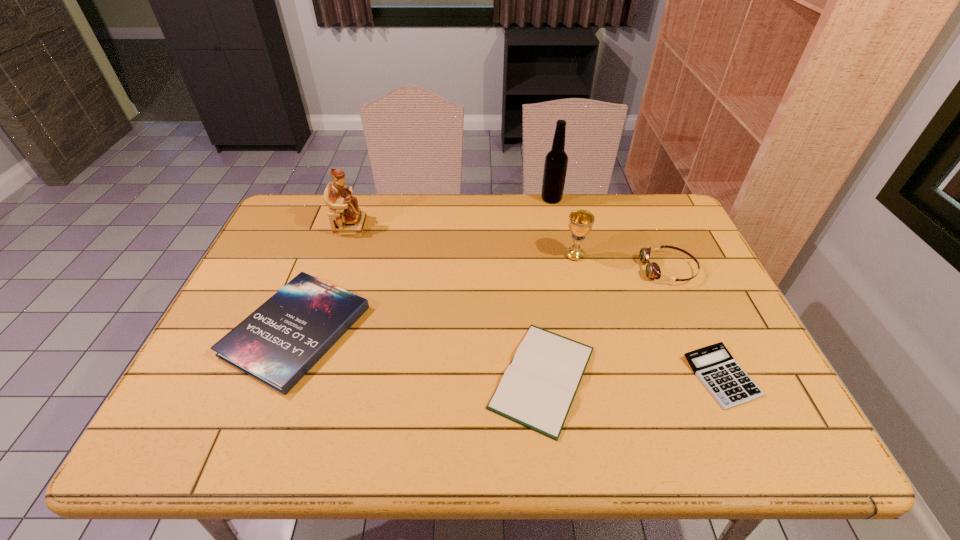
Find the location of a particular element. The width and height of the screenshot is (960, 540). empty location between the second farthest object and the goggles is located at coordinates (510, 247).

Find the location of a particular element. Image resolution: width=960 pixels, height=540 pixels. free spot between the left hardback book and the fourth shortest object is located at coordinates (483, 300).

Locate an element on the screen. blank region between the goggles and the chalice is located at coordinates (622, 262).

The width and height of the screenshot is (960, 540). I want to click on free space between the left hardback book and the figurine, so [x=324, y=278].

Where is `vacant region between the figurine and the farthest object`? Image resolution: width=960 pixels, height=540 pixels. vacant region between the figurine and the farthest object is located at coordinates (451, 212).

You are a GUI agent. You are given a task and a screenshot of the screen. Output one action in this format:
    pyautogui.click(x=<x>, y=<y>)
    Task: Click on the free spot between the calculator and the right hardback book
    The image size is (960, 540).
    Given the screenshot: What is the action you would take?
    pyautogui.click(x=633, y=377)

The image size is (960, 540). I want to click on empty space that is in between the tallest object and the fourth shortest object, so click(611, 234).

Locate an element on the screen. This screenshot has height=540, width=960. empty space between the tallest object and the fourth tallest object is located at coordinates (611, 234).

Locate an element on the screen. This screenshot has width=960, height=540. free spot between the calculator and the second farthest object is located at coordinates (537, 301).

Locate which object ranks sixth in proximity to the figurine. Please provide its 2D coordinates. Your answer should be formatted as a tuple, i.e. [(x, y)], where the tuple contains the x and y coordinates of a point satisfying the conditions above.

[(728, 383)]